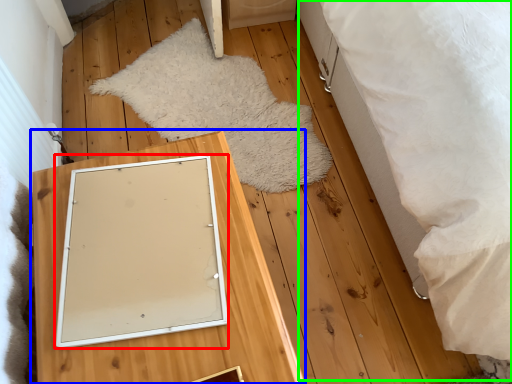
Question: Which object is positioned farthest from picture frame (highlighted by a red box)? Select from furniture (highlighted by a blue box) and bed (highlighted by a green box).

Choices:
 (A) furniture
 (B) bed

Answer: (B)